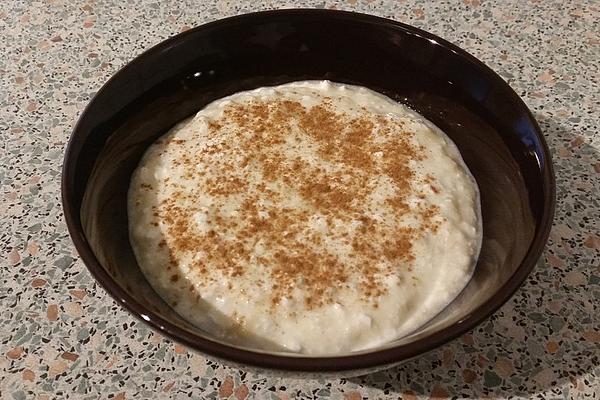
Locate an element on the screen. shadows of bowl is located at coordinates (565, 325), (138, 248).